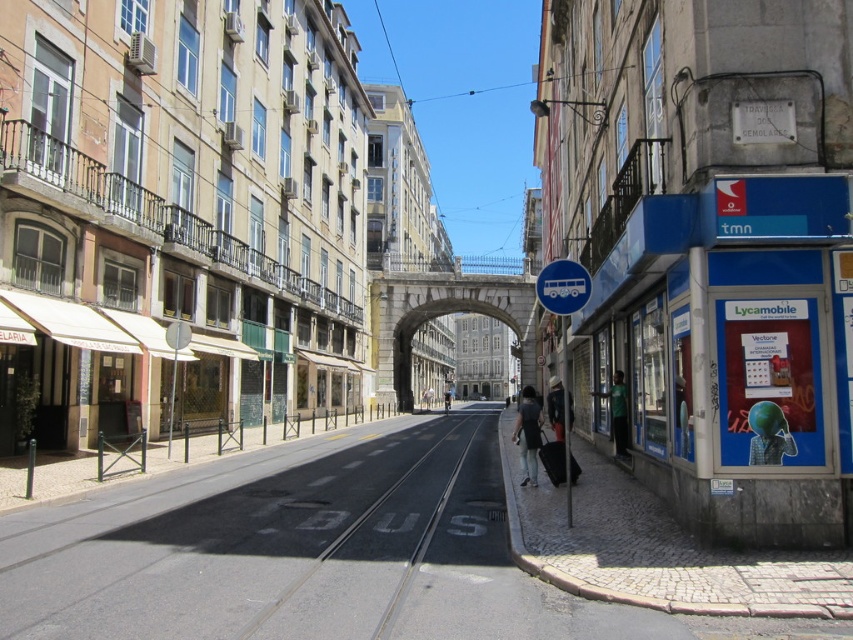
Question: Among these points, which one is farthest from the camera?

Choices:
 (A) (549, 387)
 (B) (538, 435)

Answer: (A)

Question: Can you confirm if green matte shirt at center is thinner than dark gray fabric jacket at center?

Choices:
 (A) yes
 (B) no

Answer: (A)

Question: Can you confirm if black asphalt train track at center is smaller than dark gray fabric jacket at center?

Choices:
 (A) no
 (B) yes

Answer: (B)

Question: Which object appears closest to the camera in this image?

Choices:
 (A) black fabric suitcase at lower center
 (B) dark gray fabric jacket at center
 (C) green matte shirt at center

Answer: (A)

Question: Is green matte shirt at center thinner than black fabric suitcase at lower center?

Choices:
 (A) yes
 (B) no

Answer: (A)

Question: Among these objects, which one is nearest to the camera?

Choices:
 (A) dark gray fabric jacket at center
 (B) black asphalt train track at center

Answer: (B)